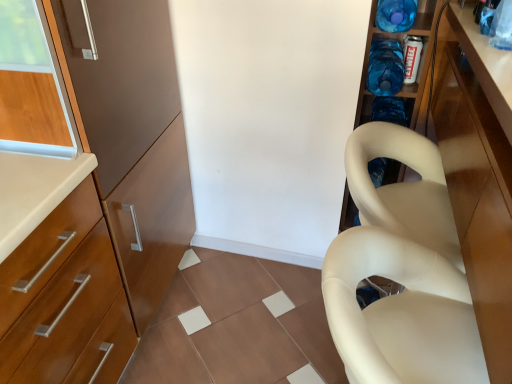
Locate an element on the screen. The image size is (512, 384). blue plastic bottle at upper right, the 2th bottle positioned from the top is located at coordinates (385, 67).

The width and height of the screenshot is (512, 384). What do you see at coordinates (396, 15) in the screenshot? I see `blue translucent bottle at upper right, the second bottle ordered from the bottom` at bounding box center [396, 15].

At what (x,y) coordinates should I click in order to perform the action: click on blue plastic bottle at upper right, the 2th bottle positioned from the top. Please return your answer as a coordinate pair (x, y). Looking at the image, I should click on (385, 67).

Considering the positions of objects beige matte plastic chair at right and blue translucent bottle at upper right, the second bottle ordered from the bottom, in the image provided, who is more to the left, beige matte plastic chair at right or blue translucent bottle at upper right, the second bottle ordered from the bottom,?

beige matte plastic chair at right is more to the left.

How much distance is there between beige matte plastic chair at right and blue translucent bottle at upper right, which is counted as the 1th bottle, starting from the top?

beige matte plastic chair at right is 37.70 inches from blue translucent bottle at upper right, which is counted as the 1th bottle, starting from the top.

Between point (425, 256) and point (382, 15), which one is positioned behind?

The point (382, 15) is behind.

Between beige matte plastic chair at right and blue translucent bottle at upper right, which is counted as the 1th bottle, starting from the top, which one has smaller width?

blue translucent bottle at upper right, which is counted as the 1th bottle, starting from the top, is thinner.

From a real-world perspective, starting from the glossy wood cabinet at right, which bottle is the 1st one vertically above it? Please provide its 2D coordinates.

[(385, 67)]

From a real-world perspective, which is physically above, glossy wood cabinet at right or blue plastic bottle at upper right, which ranks as the first bottle in bottom-to-top order?

blue plastic bottle at upper right, which ranks as the first bottle in bottom-to-top order.

Considering the sizes of objects glossy wood cabinet at right and blue plastic bottle at upper right, which ranks as the first bottle in bottom-to-top order, in the image provided, who is bigger, glossy wood cabinet at right or blue plastic bottle at upper right, which ranks as the first bottle in bottom-to-top order,?

glossy wood cabinet at right is bigger.

Considering the positions of objects glossy wood cabinet at right and blue plastic bottle at upper right, which ranks as the first bottle in bottom-to-top order, in the image provided, who is more to the left, glossy wood cabinet at right or blue plastic bottle at upper right, which ranks as the first bottle in bottom-to-top order,?

blue plastic bottle at upper right, which ranks as the first bottle in bottom-to-top order, is more to the left.

What's the angular difference between blue plastic bottle at upper right, the 2th bottle positioned from the top, and glossy wood cabinet at right's facing directions?

The angle between the facing direction of blue plastic bottle at upper right, the 2th bottle positioned from the top, and the facing direction of glossy wood cabinet at right is 88.3 degrees.

From the image's perspective, is blue plastic bottle at upper right, the 2th bottle positioned from the top, located above glossy wood cabinet at right?

Yes.

Considering the relative sizes of blue plastic bottle at upper right, the 2th bottle positioned from the top, and glossy wood cabinet at right in the image provided, is blue plastic bottle at upper right, the 2th bottle positioned from the top, taller than glossy wood cabinet at right?

In fact, blue plastic bottle at upper right, the 2th bottle positioned from the top, may be shorter than glossy wood cabinet at right.

Looking at this image, from a real-world perspective, is blue plastic bottle at upper right, which ranks as the first bottle in bottom-to-top order, positioned above or below glossy wood cabinet at right?

blue plastic bottle at upper right, which ranks as the first bottle in bottom-to-top order, is above glossy wood cabinet at right.

Does blue plastic bottle at upper right, the 2th bottle positioned from the top, touch blue translucent bottle at upper right, which is counted as the 1th bottle, starting from the top?

No, blue plastic bottle at upper right, the 2th bottle positioned from the top, is not making contact with blue translucent bottle at upper right, which is counted as the 1th bottle, starting from the top.

What's the angular difference between blue plastic bottle at upper right, which ranks as the first bottle in bottom-to-top order, and blue translucent bottle at upper right, the second bottle ordered from the bottom,'s facing directions?

2.07e-05 degrees.

Is blue plastic bottle at upper right, the 2th bottle positioned from the top, taller than blue translucent bottle at upper right, which is counted as the 1th bottle, starting from the top?

Indeed, blue plastic bottle at upper right, the 2th bottle positioned from the top, has a greater height compared to blue translucent bottle at upper right, which is counted as the 1th bottle, starting from the top.

Is blue plastic bottle at upper right, which ranks as the first bottle in bottom-to-top order, positioned in front of blue translucent bottle at upper right, the second bottle ordered from the bottom?

That is False.

Is beige matte plastic chair at right outside of blue plastic bottle at upper right, the 2th bottle positioned from the top?

Indeed, beige matte plastic chair at right is completely outside blue plastic bottle at upper right, the 2th bottle positioned from the top.

The width and height of the screenshot is (512, 384). I want to click on bottle that is the 2nd object located behind the beige matte plastic chair at right, so click(385, 67).

Is beige matte plastic chair at right further to camera compared to blue plastic bottle at upper right, which ranks as the first bottle in bottom-to-top order?

No, beige matte plastic chair at right is closer to the viewer.

What's the angular difference between beige matte plastic chair at right and blue plastic bottle at upper right, which ranks as the first bottle in bottom-to-top order,'s facing directions?

88.6 degrees separate the facing orientations of beige matte plastic chair at right and blue plastic bottle at upper right, which ranks as the first bottle in bottom-to-top order.

Which point is more distant from viewer, (x=393, y=18) or (x=404, y=361)?

The point (x=393, y=18) is farther from the camera.

Would you say blue translucent bottle at upper right, which is counted as the 1th bottle, starting from the top, is inside or outside beige matte plastic chair at right?

blue translucent bottle at upper right, which is counted as the 1th bottle, starting from the top, lies outside beige matte plastic chair at right.

Between blue translucent bottle at upper right, the second bottle ordered from the bottom, and beige matte plastic chair at right, which one appears on the left side from the viewer's perspective?

beige matte plastic chair at right.

What's the angular difference between blue translucent bottle at upper right, the second bottle ordered from the bottom, and beige matte plastic chair at right's facing directions?

The angle between the facing direction of blue translucent bottle at upper right, the second bottle ordered from the bottom, and the facing direction of beige matte plastic chair at right is 88.6 degrees.

Is blue plastic bottle at upper right, which ranks as the first bottle in bottom-to-top order, completely or partially outside of beige matte plastic chair at right?

Indeed, blue plastic bottle at upper right, which ranks as the first bottle in bottom-to-top order, is completely outside beige matte plastic chair at right.

Is blue plastic bottle at upper right, which ranks as the first bottle in bottom-to-top order, not near beige matte plastic chair at right?

Actually, blue plastic bottle at upper right, which ranks as the first bottle in bottom-to-top order, and beige matte plastic chair at right are a little close together.

How many degrees apart are the facing directions of blue plastic bottle at upper right, which ranks as the first bottle in bottom-to-top order, and beige matte plastic chair at right?

There is a 88.6-degree angle between the facing directions of blue plastic bottle at upper right, which ranks as the first bottle in bottom-to-top order, and beige matte plastic chair at right.

From a real-world perspective, which object rests below the other?

In real-world perspective, beige matte plastic chair at right is lower.

Where is `feeding chair below the blue translucent bottle at upper right, the second bottle ordered from the bottom (from a real-world perspective)`? This screenshot has height=384, width=512. feeding chair below the blue translucent bottle at upper right, the second bottle ordered from the bottom (from a real-world perspective) is located at coordinates (400, 312).

The height and width of the screenshot is (384, 512). What are the coordinates of `cabinetry in front of the blue plastic bottle at upper right, which ranks as the first bottle in bottom-to-top order` in the screenshot? It's located at (477, 187).

From the image, which object appears to be farther from blue translucent bottle at upper right, which is counted as the 1th bottle, starting from the top, beige matte plastic chair at right or blue plastic bottle at upper right, the 2th bottle positioned from the top?

beige matte plastic chair at right is further to blue translucent bottle at upper right, which is counted as the 1th bottle, starting from the top.

Consider the image. Which object lies further to the anchor point beige matte plastic chair at right, blue translucent bottle at upper right, which is counted as the 1th bottle, starting from the top, or blue plastic bottle at upper right, which ranks as the first bottle in bottom-to-top order?

blue translucent bottle at upper right, which is counted as the 1th bottle, starting from the top, is positioned further to the anchor beige matte plastic chair at right.

From the image, which object appears to be nearer to glossy wood cabinet at right, beige matte plastic chair at right or blue plastic bottle at upper right, which ranks as the first bottle in bottom-to-top order?

beige matte plastic chair at right lies closer to glossy wood cabinet at right than the other object.

In the scene shown: Based on their spatial positions, is glossy wood cabinet at right or blue translucent bottle at upper right, the second bottle ordered from the bottom, further from beige matte plastic chair at right?

The object further to beige matte plastic chair at right is blue translucent bottle at upper right, the second bottle ordered from the bottom.

Looking at the image, which one is located further to glossy wood cabinet at right, beige matte plastic chair at right or blue translucent bottle at upper right, the second bottle ordered from the bottom?

The object further to glossy wood cabinet at right is blue translucent bottle at upper right, the second bottle ordered from the bottom.

Considering their positions, is beige matte plastic chair at right positioned closer to blue translucent bottle at upper right, which is counted as the 1th bottle, starting from the top, than glossy wood cabinet at right?

glossy wood cabinet at right is closer to blue translucent bottle at upper right, which is counted as the 1th bottle, starting from the top.

Which object lies further to the anchor point blue plastic bottle at upper right, the 2th bottle positioned from the top, blue translucent bottle at upper right, which is counted as the 1th bottle, starting from the top, or glossy wood cabinet at right?

glossy wood cabinet at right is positioned further to the anchor blue plastic bottle at upper right, the 2th bottle positioned from the top.

Estimate the real-world distances between objects in this image. Which object is closer to glossy wood cabinet at right, blue plastic bottle at upper right, which ranks as the first bottle in bottom-to-top order, or blue translucent bottle at upper right, which is counted as the 1th bottle, starting from the top?

Among the two, blue plastic bottle at upper right, which ranks as the first bottle in bottom-to-top order, is located nearer to glossy wood cabinet at right.

Identify the location of cabinetry between blue translucent bottle at upper right, the second bottle ordered from the bottom, and beige matte plastic chair at right in the up-down direction. This screenshot has width=512, height=384. (477, 187).

Identify the location of feeding chair located between glossy wood cabinet at right and blue plastic bottle at upper right, which ranks as the first bottle in bottom-to-top order, in the depth direction. The width and height of the screenshot is (512, 384). (400, 312).

You are a GUI agent. You are given a task and a screenshot of the screen. Output one action in this format:
    pyautogui.click(x=<x>, y=<y>)
    Task: Click on the bottle between glossy wood cabinet at right and blue plastic bottle at upper right, the 2th bottle positioned from the top, in the front-back direction
    Image resolution: width=512 pixels, height=384 pixels.
    Given the screenshot: What is the action you would take?
    pyautogui.click(x=396, y=15)

Where is `bottle that lies between blue translucent bottle at upper right, the second bottle ordered from the bottom, and beige matte plastic chair at right from top to bottom`? The width and height of the screenshot is (512, 384). bottle that lies between blue translucent bottle at upper right, the second bottle ordered from the bottom, and beige matte plastic chair at right from top to bottom is located at coordinates (385, 67).